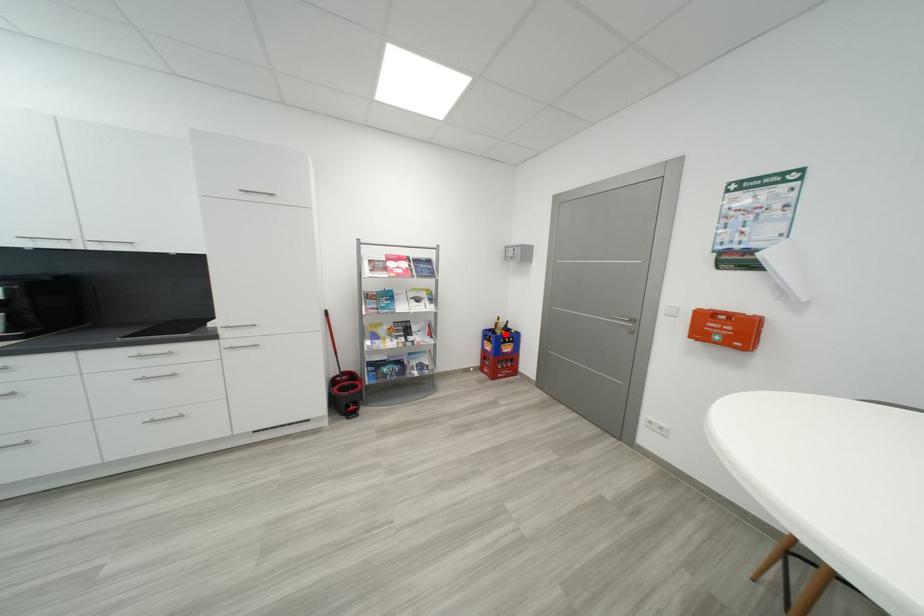
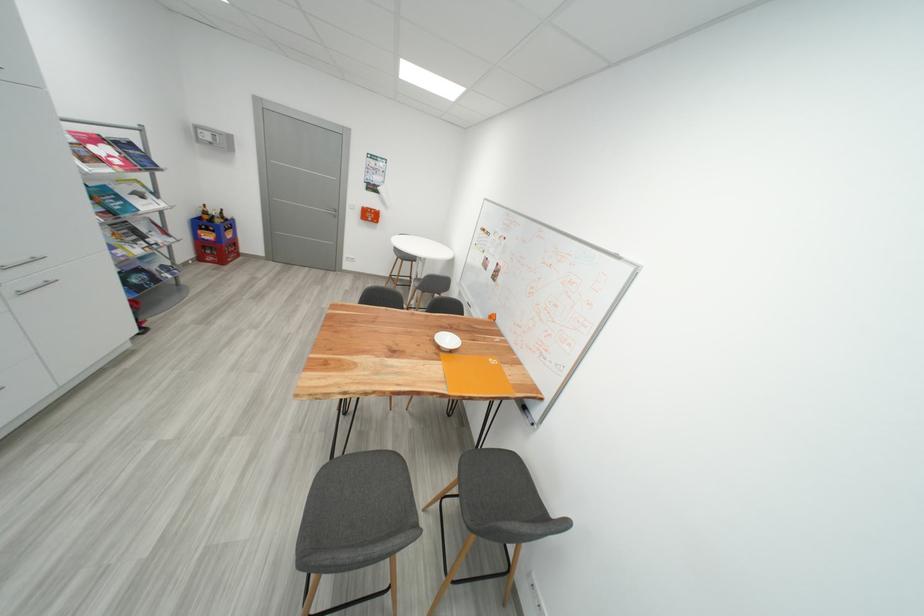
Question: I am providing you with two images of the same scene from different viewpoints. Image1 has a red point marked. In image2, the corresponding 3D location appears at what relative position? Reply with the corresponding letter.

Choices:
 (A) Closer
 (B) Farther

Answer: (A)